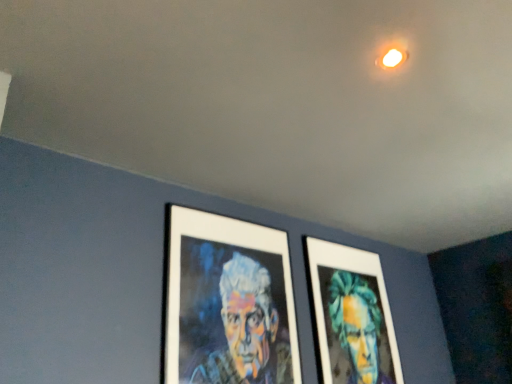
Locate an element on the screen. The width and height of the screenshot is (512, 384). multicolored canvas portrait at center, the second person from the right is located at coordinates (247, 330).

Measure the distance between multicolored canvas portrait at center, the second person from the right, and camera.

multicolored canvas portrait at center, the second person from the right, is 1.61 meters away from camera.

Measure the distance between point [273,350] and camera.

They are 6.29 feet apart.

What do you see at coordinates (247, 330) in the screenshot? I see `multicolored canvas portrait at center, which is the first person from left to right` at bounding box center [247, 330].

Measure the distance between point (343, 294) and camera.

A distance of 7.88 feet exists between point (343, 294) and camera.

Image resolution: width=512 pixels, height=384 pixels. What do you see at coordinates (357, 326) in the screenshot?
I see `matte green portrait at center, the second person from the left` at bounding box center [357, 326].

I want to click on matte green portrait at center, the second person from the left, so click(357, 326).

Identify the location of multicolored canvas portrait at center, the second person from the right. (247, 330).

Considering the positions of objects matte green portrait at center, the 1th person in the right-to-left sequence, and multicolored canvas portrait at center, which is the first person from left to right, in the image provided, who is more to the right, matte green portrait at center, the 1th person in the right-to-left sequence, or multicolored canvas portrait at center, which is the first person from left to right,?

Positioned to the right is matte green portrait at center, the 1th person in the right-to-left sequence.

Considering the positions of objects matte green portrait at center, the second person from the left, and multicolored canvas portrait at center, which is the first person from left to right, in the image provided, who is in front, matte green portrait at center, the second person from the left, or multicolored canvas portrait at center, which is the first person from left to right,?

multicolored canvas portrait at center, which is the first person from left to right, is closer to the camera.

Between point (375, 349) and point (239, 354), which one is positioned in front?

Positioned in front is point (239, 354).

From the image's perspective, is matte green portrait at center, the 1th person in the right-to-left sequence, located above or below multicolored canvas portrait at center, which is the first person from left to right?

Clearly, from the image's perspective, matte green portrait at center, the 1th person in the right-to-left sequence, is below multicolored canvas portrait at center, which is the first person from left to right.

From a real-world perspective, is matte green portrait at center, the 1th person in the right-to-left sequence, above or below multicolored canvas portrait at center, which is the first person from left to right?

matte green portrait at center, the 1th person in the right-to-left sequence, is situated lower than multicolored canvas portrait at center, which is the first person from left to right, in the real world.

Considering the sizes of objects matte green portrait at center, the 1th person in the right-to-left sequence, and multicolored canvas portrait at center, which is the first person from left to right, in the image provided, who is thinner, matte green portrait at center, the 1th person in the right-to-left sequence, or multicolored canvas portrait at center, which is the first person from left to right,?

With smaller width is multicolored canvas portrait at center, which is the first person from left to right.

Which of these two, matte green portrait at center, the 1th person in the right-to-left sequence, or multicolored canvas portrait at center, the second person from the right, stands taller?

With more height is matte green portrait at center, the 1th person in the right-to-left sequence.

Does matte green portrait at center, the second person from the left, have a smaller size compared to multicolored canvas portrait at center, the second person from the right?

Actually, matte green portrait at center, the second person from the left, might be larger than multicolored canvas portrait at center, the second person from the right.

Is matte green portrait at center, the 1th person in the right-to-left sequence, positioned beyond the bounds of multicolored canvas portrait at center, the second person from the right?

matte green portrait at center, the 1th person in the right-to-left sequence, is positioned outside multicolored canvas portrait at center, the second person from the right.

Are matte green portrait at center, the 1th person in the right-to-left sequence, and multicolored canvas portrait at center, which is the first person from left to right, located far from each other?

No.

Is matte green portrait at center, the 1th person in the right-to-left sequence, oriented away from multicolored canvas portrait at center, which is the first person from left to right?

No, matte green portrait at center, the 1th person in the right-to-left sequence,'s orientation is not away from multicolored canvas portrait at center, which is the first person from left to right.

Looking at this image, how many degrees apart are the facing directions of matte green portrait at center, the 1th person in the right-to-left sequence, and multicolored canvas portrait at center, which is the first person from left to right?

The angle between the facing direction of matte green portrait at center, the 1th person in the right-to-left sequence, and the facing direction of multicolored canvas portrait at center, which is the first person from left to right, is 0.00402 degrees.

Identify the location of person below the multicolored canvas portrait at center, which is the first person from left to right (from a real-world perspective). (357, 326).

Is multicolored canvas portrait at center, which is the first person from left to right, at the right side of matte green portrait at center, the second person from the left?

In fact, multicolored canvas portrait at center, which is the first person from left to right, is to the left of matte green portrait at center, the second person from the left.

Is multicolored canvas portrait at center, the second person from the right, behind matte green portrait at center, the second person from the left?

No, multicolored canvas portrait at center, the second person from the right, is closer to the camera.

Is point (276, 341) closer to viewer compared to point (357, 359)?

Yes.

From the image's perspective, between multicolored canvas portrait at center, which is the first person from left to right, and matte green portrait at center, the 1th person in the right-to-left sequence, who is located below?

matte green portrait at center, the 1th person in the right-to-left sequence.

From a real-world perspective, which is physically above, multicolored canvas portrait at center, which is the first person from left to right, or matte green portrait at center, the 1th person in the right-to-left sequence?

From a 3D spatial view, multicolored canvas portrait at center, which is the first person from left to right, is above.

Can you confirm if multicolored canvas portrait at center, which is the first person from left to right, is wider than matte green portrait at center, the second person from the left?

In fact, multicolored canvas portrait at center, which is the first person from left to right, might be narrower than matte green portrait at center, the second person from the left.

Can you confirm if multicolored canvas portrait at center, the second person from the right, is shorter than matte green portrait at center, the second person from the left?

Indeed, multicolored canvas portrait at center, the second person from the right, has a lesser height compared to matte green portrait at center, the second person from the left.

Can you confirm if multicolored canvas portrait at center, the second person from the right, is smaller than matte green portrait at center, the 1th person in the right-to-left sequence?

Yes, multicolored canvas portrait at center, the second person from the right, is smaller than matte green portrait at center, the 1th person in the right-to-left sequence.

Could matte green portrait at center, the 1th person in the right-to-left sequence, be considered to be inside multicolored canvas portrait at center, which is the first person from left to right?

No, matte green portrait at center, the 1th person in the right-to-left sequence, is not inside multicolored canvas portrait at center, which is the first person from left to right.

Is multicolored canvas portrait at center, the second person from the right, beside matte green portrait at center, the second person from the left?

No, multicolored canvas portrait at center, the second person from the right, is not beside matte green portrait at center, the second person from the left.

Is multicolored canvas portrait at center, which is the first person from left to right, facing towards matte green portrait at center, the second person from the left?

No, multicolored canvas portrait at center, which is the first person from left to right, is not facing towards matte green portrait at center, the second person from the left.

In the scene shown: Can you tell me how much multicolored canvas portrait at center, the second person from the right, and matte green portrait at center, the second person from the left, differ in facing direction?

The angular difference between multicolored canvas portrait at center, the second person from the right, and matte green portrait at center, the second person from the left, is 0.00402 degrees.

Where is `person to the left of matte green portrait at center, the second person from the left`? person to the left of matte green portrait at center, the second person from the left is located at coordinates (247, 330).

Locate an element on the screen. The image size is (512, 384). person on the left of matte green portrait at center, the second person from the left is located at coordinates (247, 330).

Locate an element on the screen. The width and height of the screenshot is (512, 384). person on the right of multicolored canvas portrait at center, which is the first person from left to right is located at coordinates (357, 326).